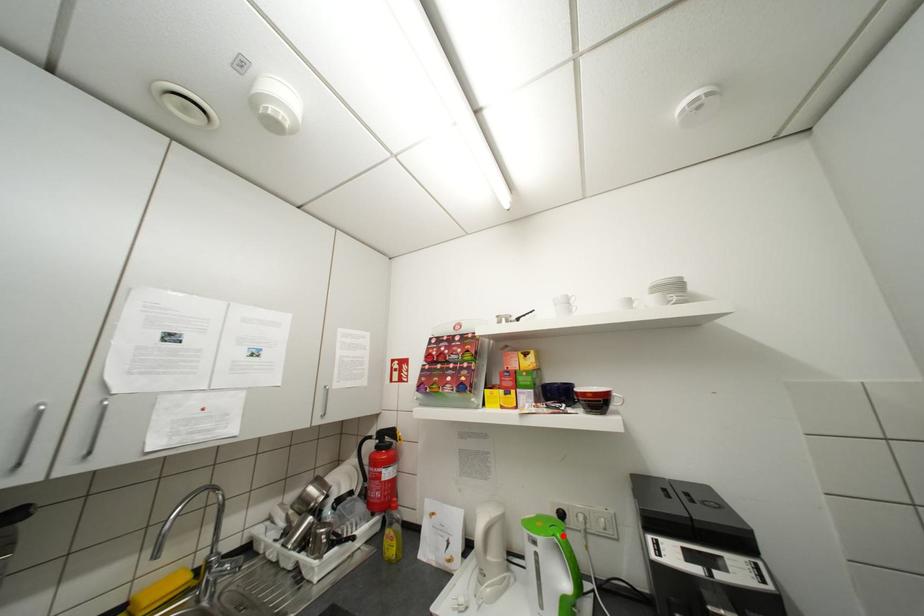
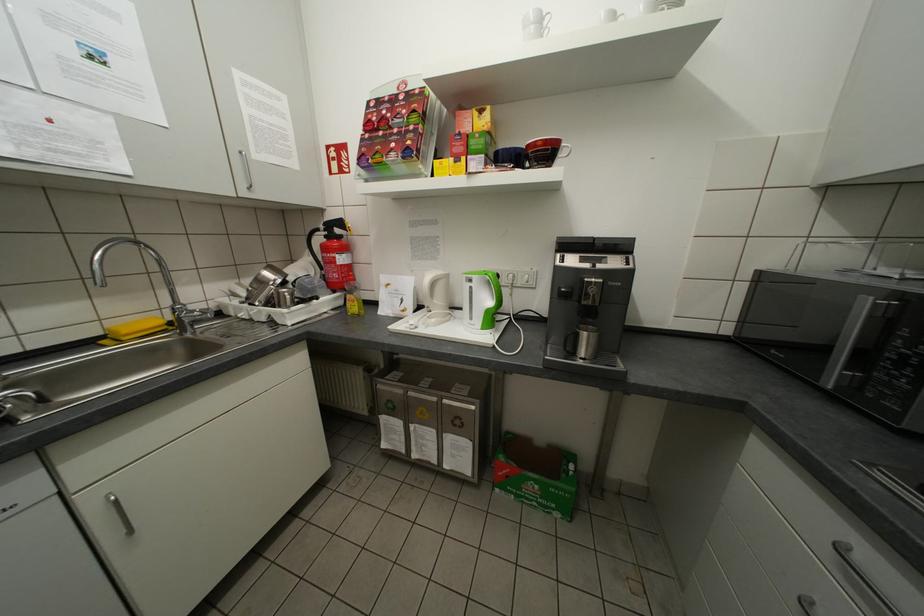
Locate, in the second image, the point that corresponds to the highlighted location in the first image.

(494, 274)